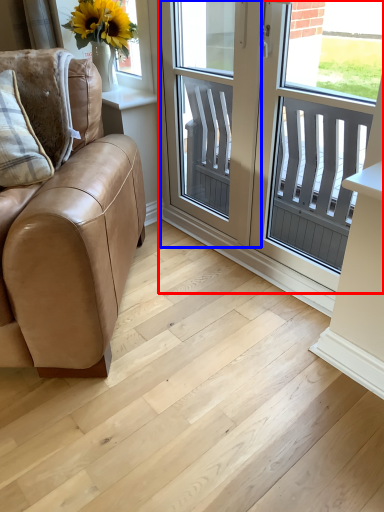
Question: Which object appears farthest to the camera in this image, window (highlighted by a red box) or screen door (highlighted by a blue box)?

Choices:
 (A) window
 (B) screen door

Answer: (B)